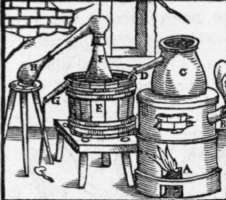
Where is `table`? table is located at coordinates (102, 142).